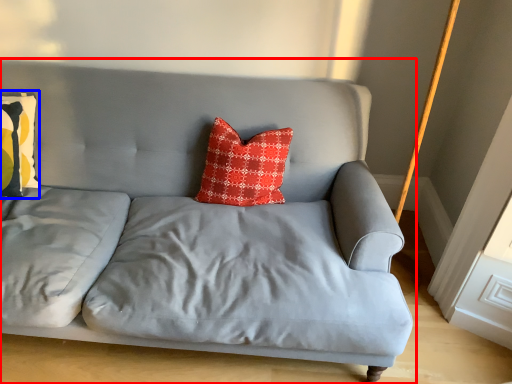
Question: Which of the following is the farthest to the observer, studio couch (highlighted by a red box) or pillow (highlighted by a blue box)?

Choices:
 (A) studio couch
 (B) pillow

Answer: (B)